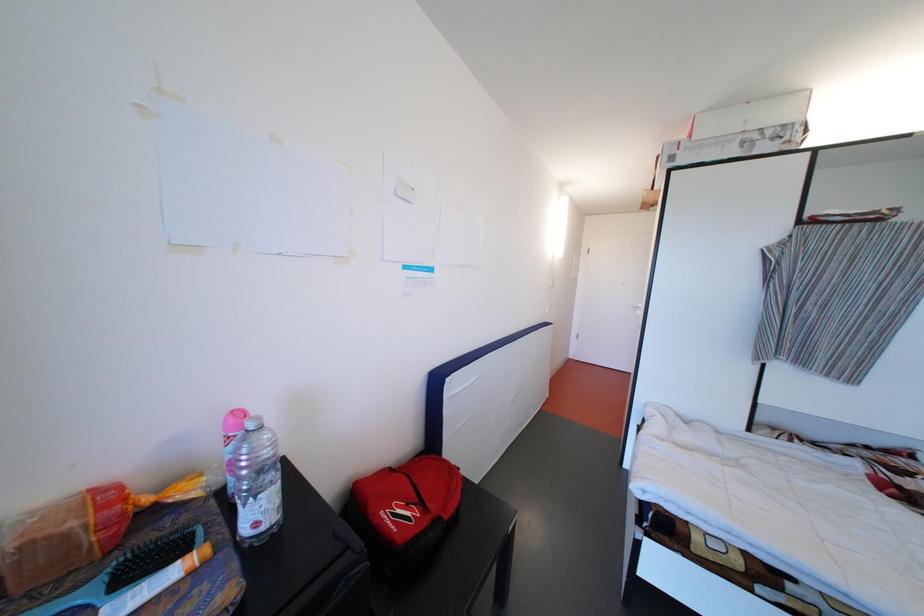
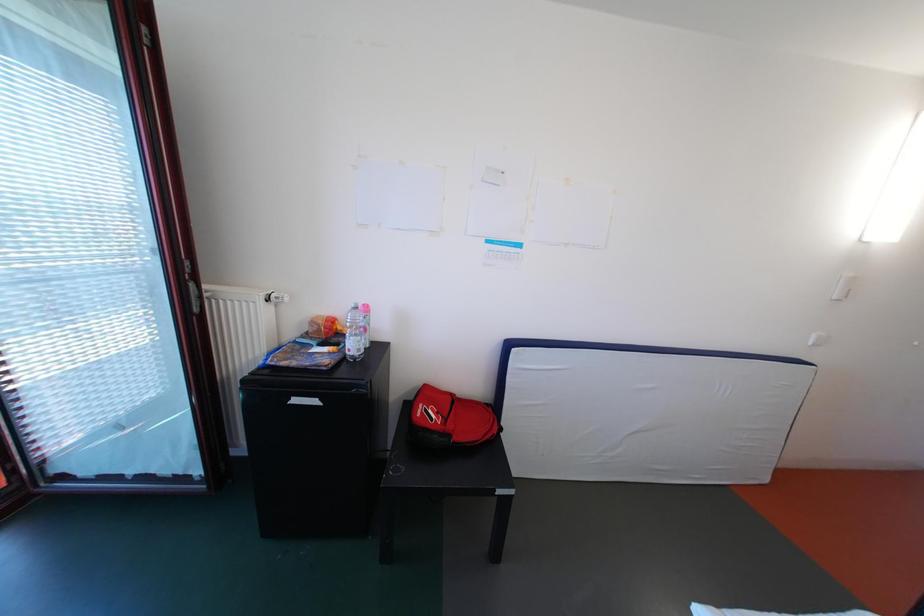
Question: The camera is either moving clockwise (left) or counter-clockwise (right) around the object. The first image is from the beginning of the video and the second image is from the end. Is the camera moving left or right when shooting the video?

Choices:
 (A) Left
 (B) Right

Answer: (B)